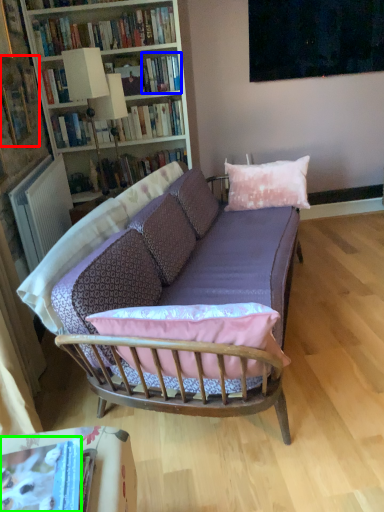
Question: Estimate the real-world distances between objects in this image. Which object is farther from book (highlighted by a red box), book (highlighted by a blue box) or book (highlighted by a green box)?

Choices:
 (A) book
 (B) book

Answer: (B)